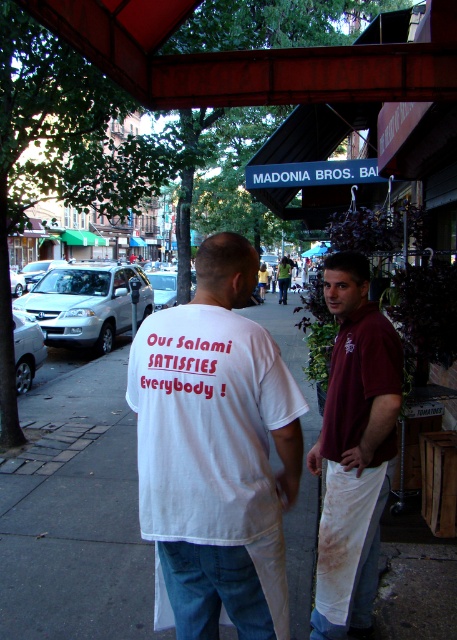
Looking at this image, is white cotton t-shirt at center shorter than maroon shirt at center?

Indeed, white cotton t-shirt at center has a lesser height compared to maroon shirt at center.

How distant is white cotton t-shirt at center from maroon shirt at center?

They are 30.51 inches apart.

Locate an element on the screen. white cotton t-shirt at center is located at coordinates (216, 449).

In order to click on white cotton t-shirt at center in this screenshot , I will do `click(216, 449)`.